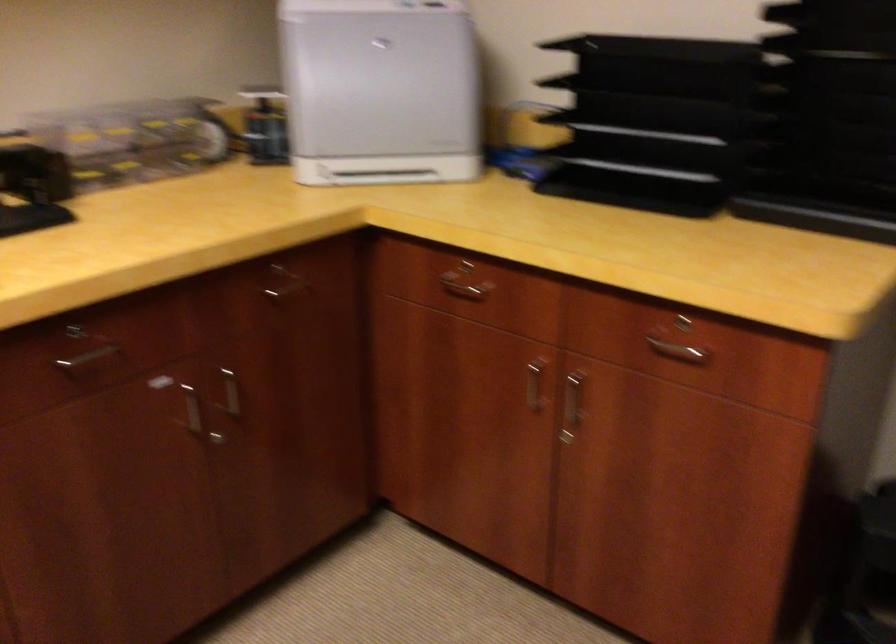
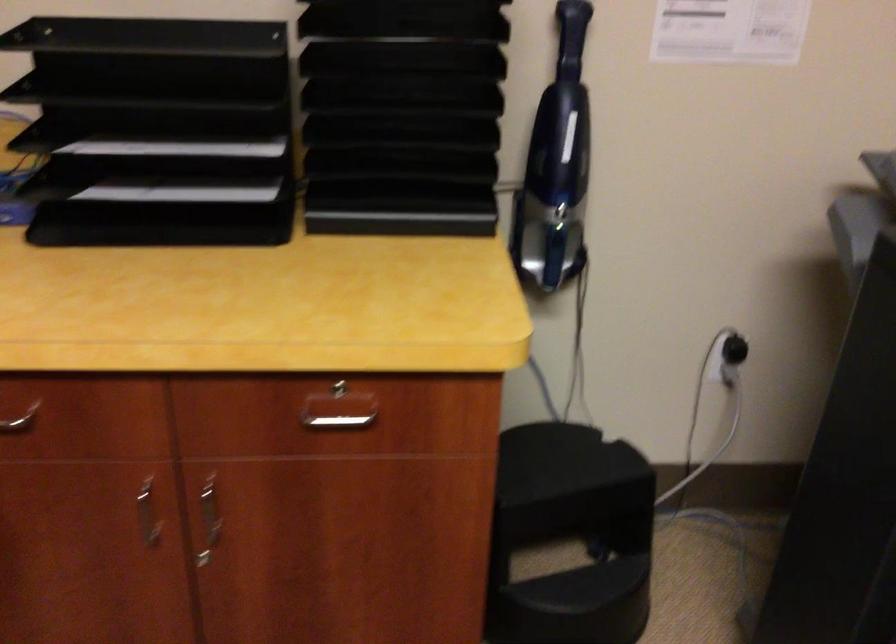
In the second image, find the point that corresponds to point (683, 357) in the first image.

(338, 422)